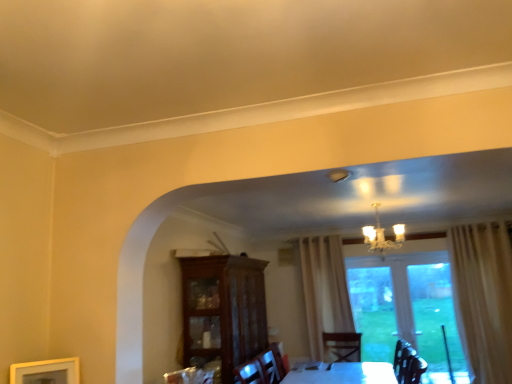
I want to click on vacant point above gold metallic chandelier at upper center (from a real-world perspective), so click(369, 201).